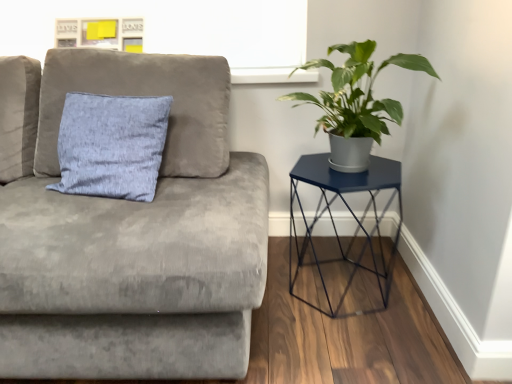
Question: From their relative heights in the image, would you say velvet gray couch at upper left is taller or shorter than metallic blue hexagonal table at right?

Choices:
 (A) short
 (B) tall

Answer: (B)

Question: Relative to metallic blue hexagonal table at right, is velvet gray couch at upper left in front or behind?

Choices:
 (A) behind
 (B) front

Answer: (B)

Question: Which is farther from the metallic blue hexagonal table at right?

Choices:
 (A) velvet gray couch at upper left
 (B) green matte plant at right

Answer: (A)

Question: Considering the real-world distances, which object is farthest from the velvet gray couch at upper left?

Choices:
 (A) metallic blue hexagonal table at right
 (B) green matte plant at right

Answer: (B)